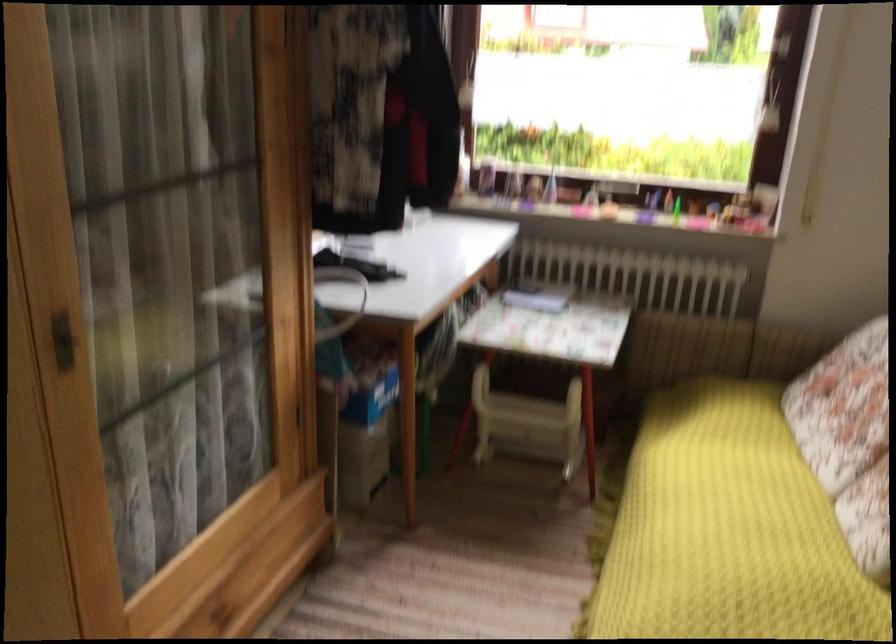
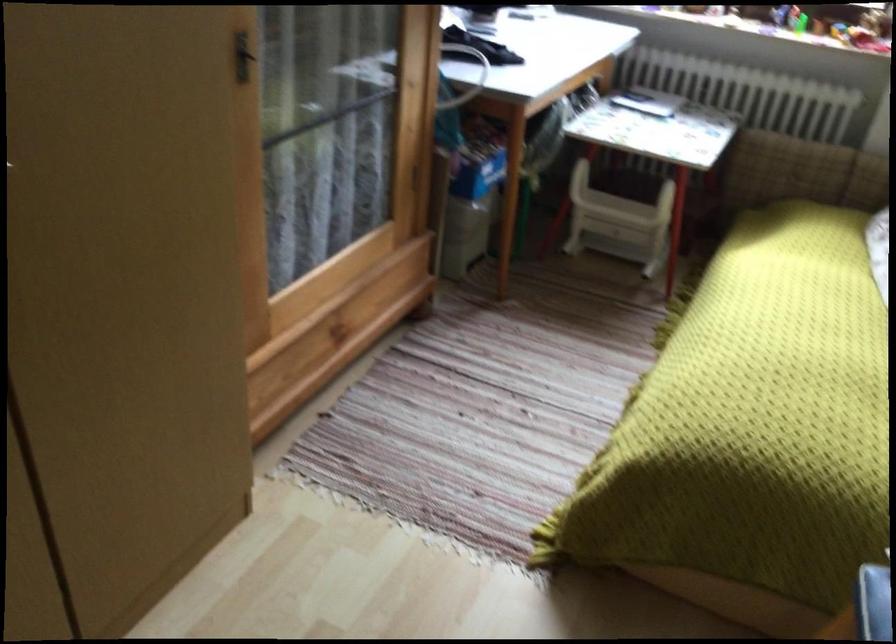
Question: The first image is from the beginning of the video and the second image is from the end. How did the camera likely rotate when shooting the video?

Choices:
 (A) Left
 (B) Right
 (C) Up
 (D) Down

Answer: (D)